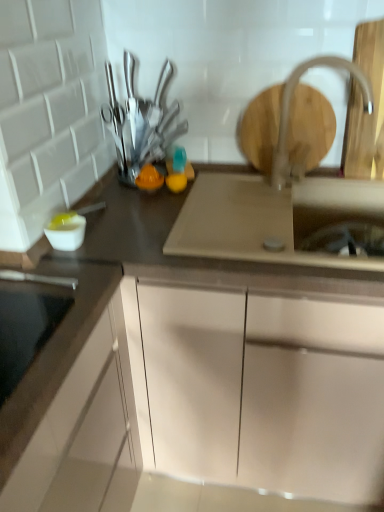
Question: Is metallic silver knives at upper center in front of or behind satin silver sink at center in the image?

Choices:
 (A) behind
 (B) front

Answer: (A)

Question: From the image's perspective, is metallic silver knives at upper center located above or below satin silver sink at center?

Choices:
 (A) below
 (B) above

Answer: (B)

Question: Which is nearer to the white matte cabinet at center?

Choices:
 (A) metallic silver knives at upper center
 (B) satin nickel faucet at upper right
 (C) satin silver sink at center

Answer: (C)

Question: Estimate the real-world distances between objects in this image. Which object is farther from the satin nickel faucet at upper right?

Choices:
 (A) metallic silver knives at upper center
 (B) satin silver sink at center
 (C) white matte cabinet at center

Answer: (C)